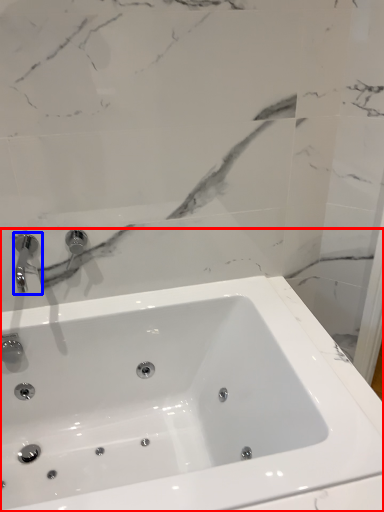
Question: Which point is further to the camera, sink (highlighted by a red box) or tap (highlighted by a blue box)?

Choices:
 (A) sink
 (B) tap

Answer: (B)